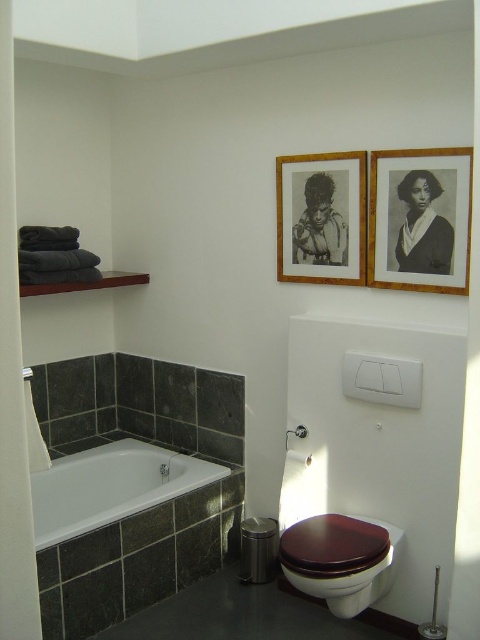
Question: Among these objects, which one is nearest to the camera?

Choices:
 (A) brown glossy toilet at lower right
 (B) white glossy bathtub at lower left
 (C) wooden picture frame at upper right
 (D) brushed metal shower at lower left

Answer: (A)

Question: Which object appears closest to the camera in this image?

Choices:
 (A) brown glossy toilet at lower right
 (B) wooden picture frame at upper center
 (C) wooden picture frame at upper right

Answer: (A)

Question: Which object is farther from the camera taking this photo?

Choices:
 (A) wooden picture frame at upper center
 (B) wooden picture frame at upper right

Answer: (A)

Question: Can you confirm if white glossy bathtub at lower left is positioned above brushed metal shower at lower left?

Choices:
 (A) yes
 (B) no

Answer: (B)

Question: Does wooden picture frame at upper right have a smaller size compared to brushed metal shower at lower left?

Choices:
 (A) no
 (B) yes

Answer: (A)

Question: Does wooden picture frame at upper center have a lesser width compared to brown glossy toilet at lower right?

Choices:
 (A) no
 (B) yes

Answer: (B)